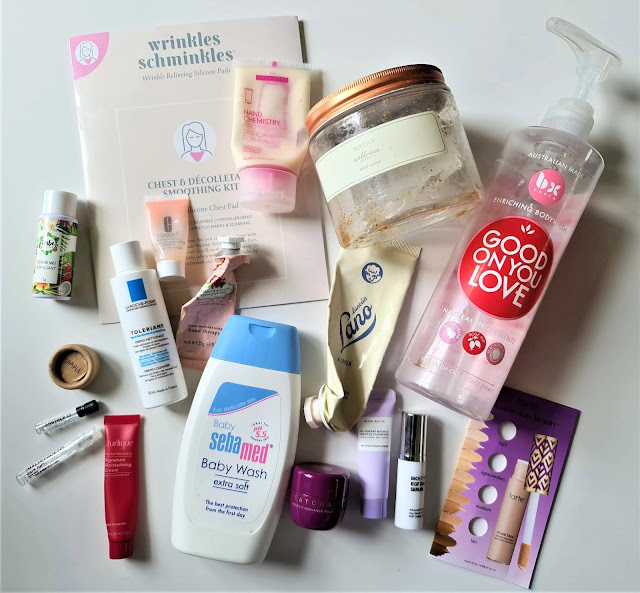
Identify the location of body wash bottle. Image resolution: width=640 pixels, height=593 pixels. (564, 197).